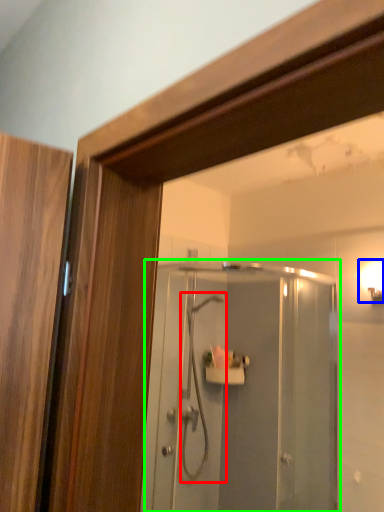
Question: Which object is positioned farthest from shower (highlighted by a red box)? Select from light fixture (highlighted by a blue box) and screen door (highlighted by a green box).

Choices:
 (A) light fixture
 (B) screen door

Answer: (A)